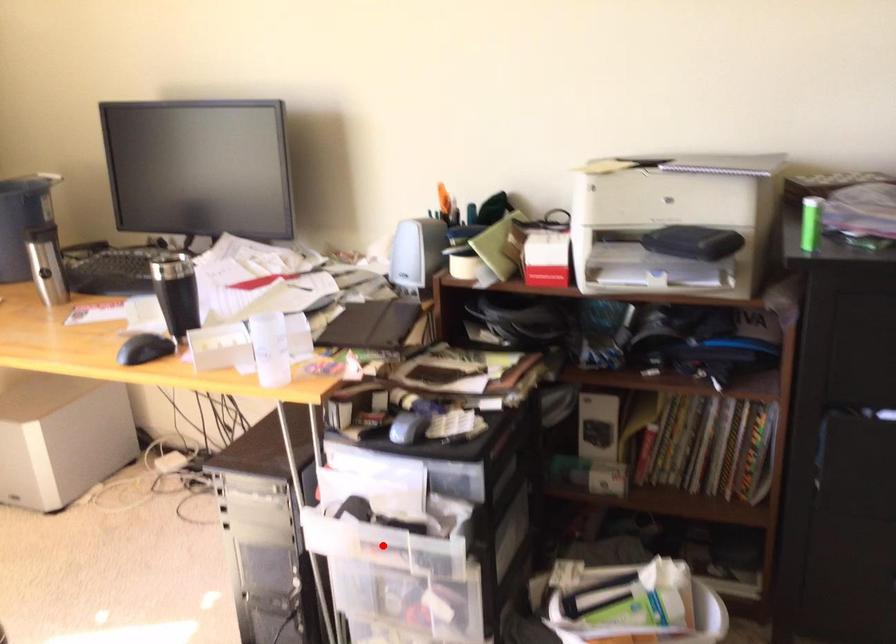
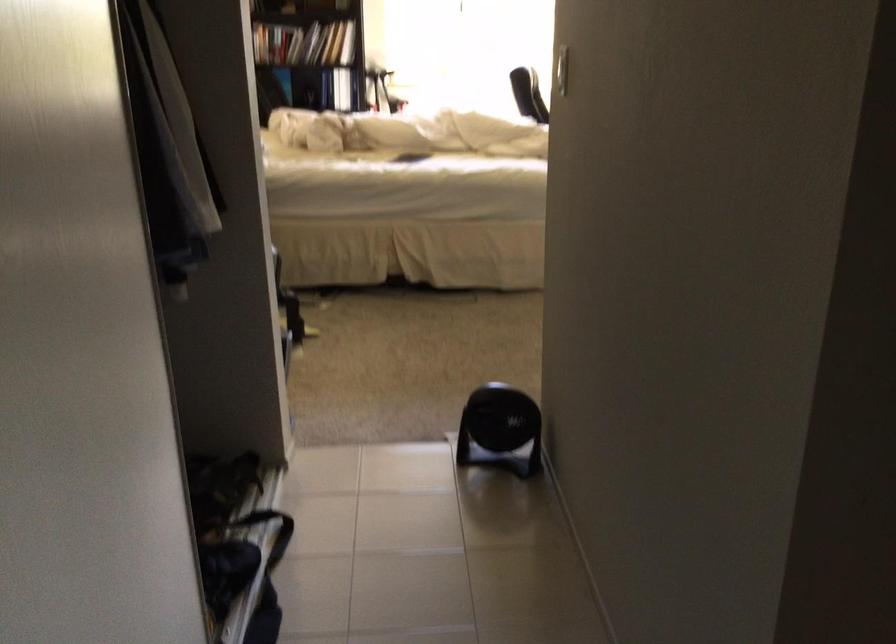
Question: I am providing you with two images of the same scene from different viewpoints. A red point is marked on the first image. Is the red point's position out of view in image 2?

Choices:
 (A) Yes
 (B) No

Answer: (A)